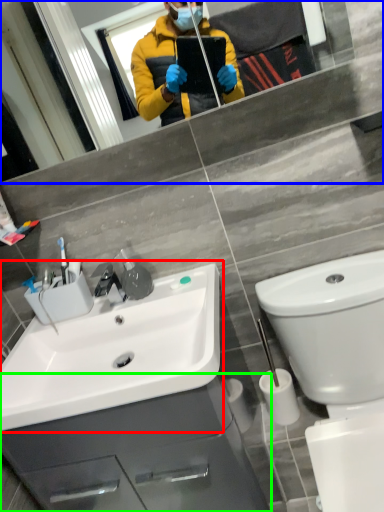
Question: Considering the real-world distances, which object is farthest from sink (highlighted by a red box)? mirror (highlighted by a blue box) or bathroom cabinet (highlighted by a green box)?

Choices:
 (A) mirror
 (B) bathroom cabinet

Answer: (A)